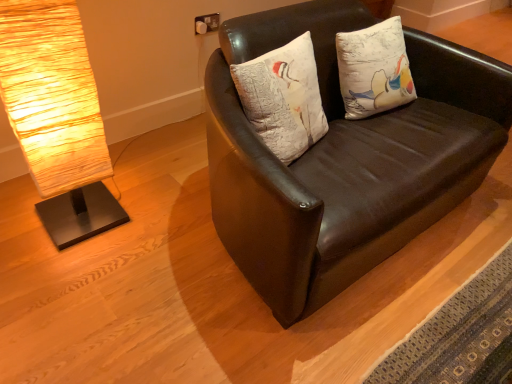
Image resolution: width=512 pixels, height=384 pixels. What do you see at coordinates (283, 98) in the screenshot? I see `white textured pillow at center` at bounding box center [283, 98].

What do you see at coordinates (346, 158) in the screenshot? I see `matte brown leather couch at center` at bounding box center [346, 158].

The image size is (512, 384). I want to click on rustic wood lamp at left, so [57, 117].

Measure the distance between rustic wood lamp at left and camera.

rustic wood lamp at left is 1.06 meters from camera.

This screenshot has width=512, height=384. What are the coordinates of `white textured pillow at center` in the screenshot? It's located at (283, 98).

How different are the orientations of rustic wood lamp at left and white textured pillow at center in degrees?

The angle between the facing direction of rustic wood lamp at left and the facing direction of white textured pillow at center is 13.2 degrees.

Is rustic wood lamp at left directly adjacent to white textured pillow at center?

No, rustic wood lamp at left is not beside white textured pillow at center.

Is white textured pillow at center at the back of rustic wood lamp at left?

That's not correct — rustic wood lamp at left is not looking away from white textured pillow at center.

In the image, is rustic wood lamp at left on the left side or the right side of white textured pillow at center?

rustic wood lamp at left is to the left of white textured pillow at center.

Is point (396, 176) closer or farther from the camera than point (310, 44)?

Clearly, point (396, 176) is closer to the camera than point (310, 44).

Which of these two, matte brown leather couch at center or white textured pillow at center, is bigger?

matte brown leather couch at center.

What's the angular difference between matte brown leather couch at center and white textured pillow at center's facing directions?

The angle between the facing direction of matte brown leather couch at center and the facing direction of white textured pillow at center is 12.1 degrees.

Does white textured pillow at center appear on the left side of rustic wood lamp at left?

In fact, white textured pillow at center is to the right of rustic wood lamp at left.

Is white textured pillow at center outside of rustic wood lamp at left?

white textured pillow at center is positioned outside rustic wood lamp at left.

Locate an element on the screen. Image resolution: width=512 pixels, height=384 pixels. pillow located above the rustic wood lamp at left (from the image's perspective) is located at coordinates (283, 98).

Considering the positions of points (320, 300) and (67, 218), is point (320, 300) farther from camera compared to point (67, 218)?

No, it is in front of (67, 218).

Based on their positions, is matte brown leather couch at center located to the left or right of rustic wood lamp at left?

matte brown leather couch at center is to the right of rustic wood lamp at left.

Consider the image. From a real-world perspective, is matte brown leather couch at center on top of rustic wood lamp at left?

Actually, matte brown leather couch at center is physically below rustic wood lamp at left in the real world.

Is matte brown leather couch at center further to camera compared to rustic wood lamp at left?

No, matte brown leather couch at center is closer to the camera.

Between point (4, 14) and point (255, 53), which one is positioned behind?

Point (255, 53)

Would you say matte brown leather couch at center is part of rustic wood lamp at left's contents?

No, matte brown leather couch at center is located outside of rustic wood lamp at left.

Is rustic wood lamp at left next to matte brown leather couch at center and touching it?

There is a gap between rustic wood lamp at left and matte brown leather couch at center.

Is white textured pillow at center bigger than matte brown leather couch at center?

Actually, white textured pillow at center might be smaller than matte brown leather couch at center.

Considering the positions of objects white textured pillow at center and matte brown leather couch at center in the image provided, who is in front, white textured pillow at center or matte brown leather couch at center?

Positioned in front is matte brown leather couch at center.

Consider the image. Does white textured pillow at center have a lesser width compared to matte brown leather couch at center?

Yes.

I want to click on lamp located in front of the white textured pillow at center, so click(x=57, y=117).

The image size is (512, 384). Find the location of `pillow above the matte brown leather couch at center (from a real-world perspective)`. pillow above the matte brown leather couch at center (from a real-world perspective) is located at coordinates (283, 98).

From the image, which object appears to be farther from white textured pillow at center, rustic wood lamp at left or matte brown leather couch at center?

Based on the image, rustic wood lamp at left appears to be further to white textured pillow at center.

Looking at this image, considering their positions, is matte brown leather couch at center positioned closer to rustic wood lamp at left than white textured pillow at center?

Based on the image, white textured pillow at center appears to be nearer to rustic wood lamp at left.

From the image, which object appears to be nearer to rustic wood lamp at left, white textured pillow at center or matte brown leather couch at center?

The object closer to rustic wood lamp at left is white textured pillow at center.

From the image, which object appears to be farther from matte brown leather couch at center, rustic wood lamp at left or white textured pillow at center?

The object further to matte brown leather couch at center is rustic wood lamp at left.

Considering their positions, is matte brown leather couch at center positioned closer to white textured pillow at center than rustic wood lamp at left?

Based on the image, matte brown leather couch at center appears to be nearer to white textured pillow at center.

Which object lies further to the anchor point matte brown leather couch at center, white textured pillow at center or rustic wood lamp at left?

Based on the image, rustic wood lamp at left appears to be further to matte brown leather couch at center.

Find the location of a particular element. The width and height of the screenshot is (512, 384). pillow between rustic wood lamp at left and matte brown leather couch at center is located at coordinates (283, 98).